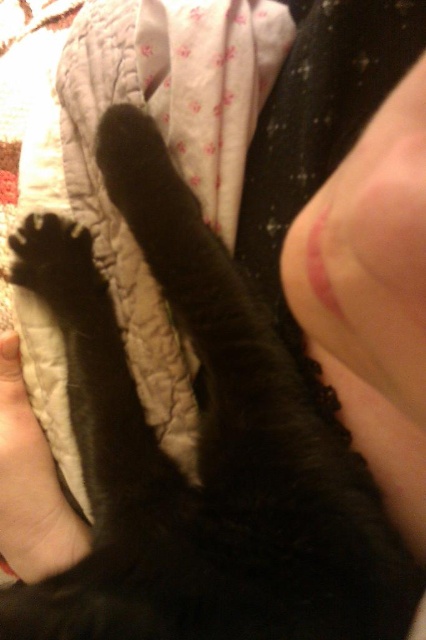
You are a photographer setting up a close shot of a cat and a hand. You need to ensure that the smooth skin at upper right and the smooth skin hand at lower left are both visible in the frame. Based on their positions, which object should you focus on first to capture both in the frame?

The smooth skin at upper right is located above the smooth skin hand at lower left, so you should focus on the smooth skin hand at lower left first to ensure both are in the frame.

You are a photographer observing the scene. You need to adjust the lighting so that both the smooth skin at upper right and the smooth skin hand at lower left are equally illuminated. Which object should you move closer to the light source?

The smooth skin at upper right is to the right of the smooth skin hand at lower left. To equally illuminate both, move the smooth skin hand at lower left closer to the light source since it is farther away from the light.

In the scene shown: You are a photographer trying to capture the texture of the smooth skin at upper right in the image. The point provided is marked at coordinates point (370, 253). Can you confirm if this point is located in the upper right area of the image?

Yes, the point (370, 253) is located in the upper right area of the image as described.